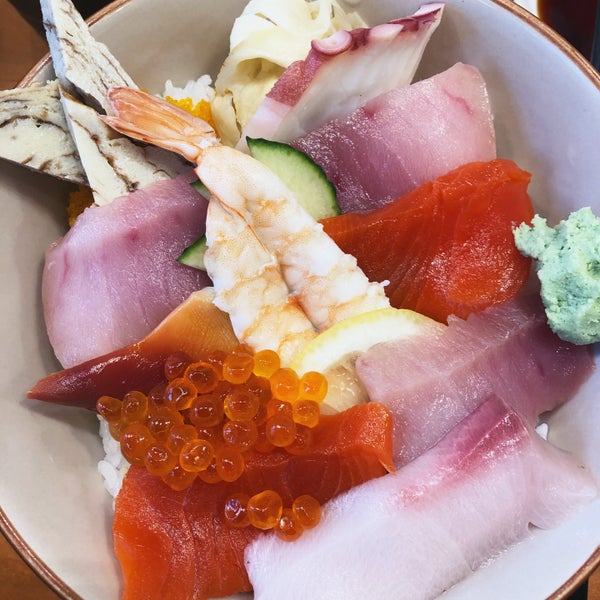
At what (x,y) coordinates should I click in order to perform the action: click on white porcelain dish with a brown trim. Please return your answer as a coordinate pair (x, y). This screenshot has width=600, height=600. Looking at the image, I should click on (43, 479).